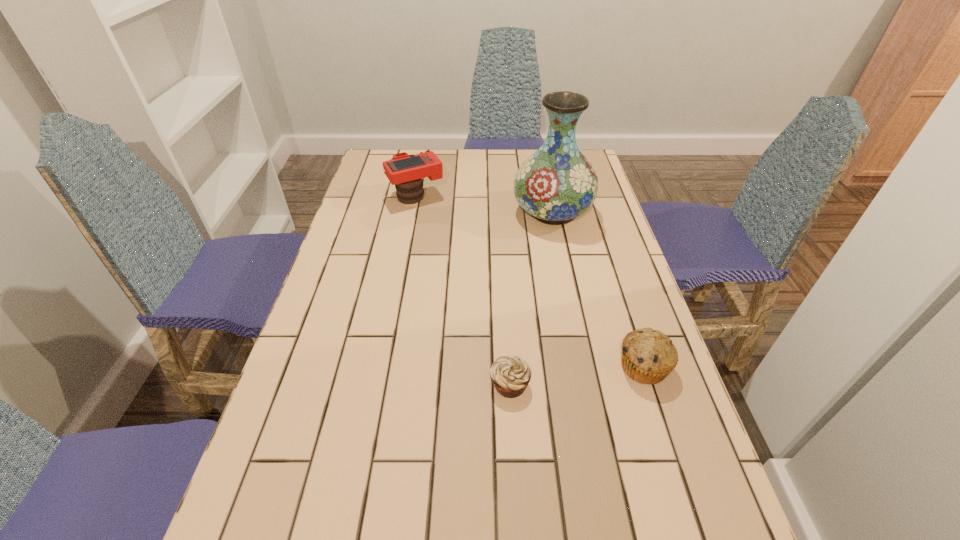
Locate an element on the screen. The image size is (960, 540). vacant space located on the front of the shorter muffin is located at coordinates (512, 425).

Where is `object that is at the left edge`? object that is at the left edge is located at coordinates (405, 171).

I want to click on vase that is at the right edge, so click(x=557, y=183).

The image size is (960, 540). I want to click on muffin at the right edge, so click(x=648, y=356).

I want to click on free region at the far edge of the desktop, so click(450, 174).

The height and width of the screenshot is (540, 960). In order to click on vacant region at the left edge of the desktop in this screenshot , I will do `click(387, 240)`.

In the image, there is a desktop. Identify the location of vacant region at the right edge. The width and height of the screenshot is (960, 540). (697, 455).

The width and height of the screenshot is (960, 540). Identify the location of free spot between the left muffin and the second tallest object. (463, 290).

Where is `vacant area that lies between the taller muffin and the vase`? The height and width of the screenshot is (540, 960). vacant area that lies between the taller muffin and the vase is located at coordinates (598, 289).

At what (x,y) coordinates should I click in order to perform the action: click on empty space between the tallest object and the second shortest object. Please return your answer as a coordinate pair (x, y). Looking at the image, I should click on (598, 289).